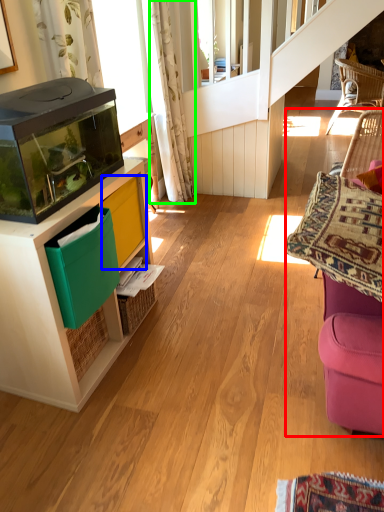
Question: Which object is positioned closest to swivel chair (highlighted by a red box)? Select from shelf (highlighted by a blue box) and curtain (highlighted by a green box).

Choices:
 (A) shelf
 (B) curtain

Answer: (A)